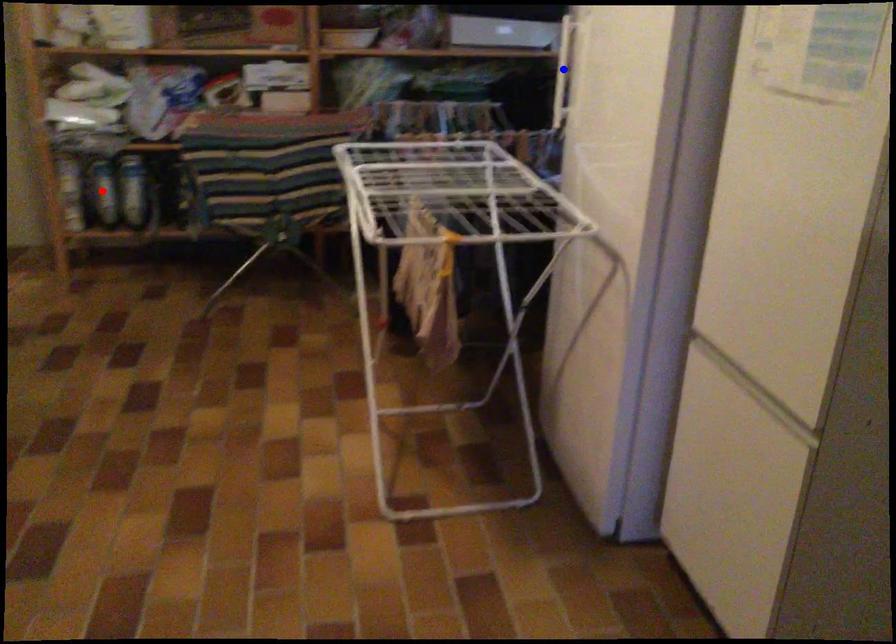
Question: Two points are marked on the image. Which point is closer to the camera?

Choices:
 (A) Blue point is closer.
 (B) Red point is closer.

Answer: (A)